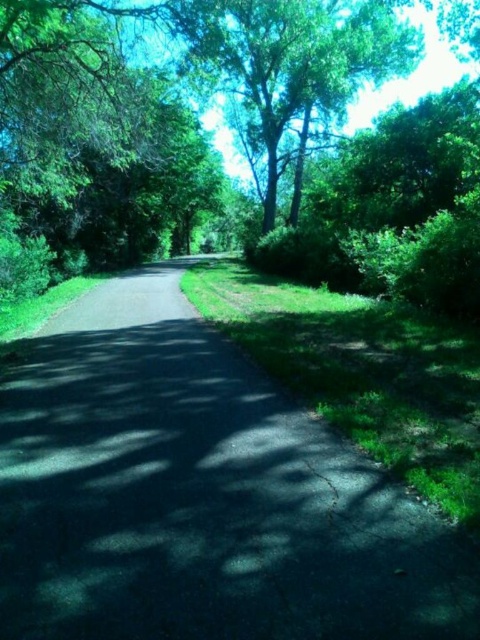
Between dark asphalt path at center and green leafy tree at upper center, which one has less height?

dark asphalt path at center is shorter.

Is dark asphalt path at center further to the viewer compared to green leafy tree at upper center?

No, it is in front of green leafy tree at upper center.

Which is in front, point (336, 580) or point (280, 33)?

Point (336, 580) is in front.

Image resolution: width=480 pixels, height=640 pixels. In order to click on dark asphalt path at center in this screenshot , I will do `click(200, 493)`.